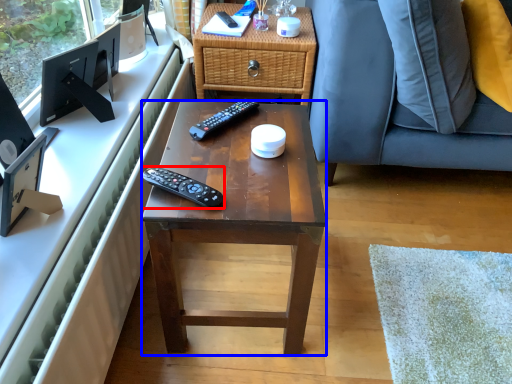
Question: Which of the following is the farthest to the observer, remote control (highlighted by a red box) or desk (highlighted by a blue box)?

Choices:
 (A) remote control
 (B) desk

Answer: (A)